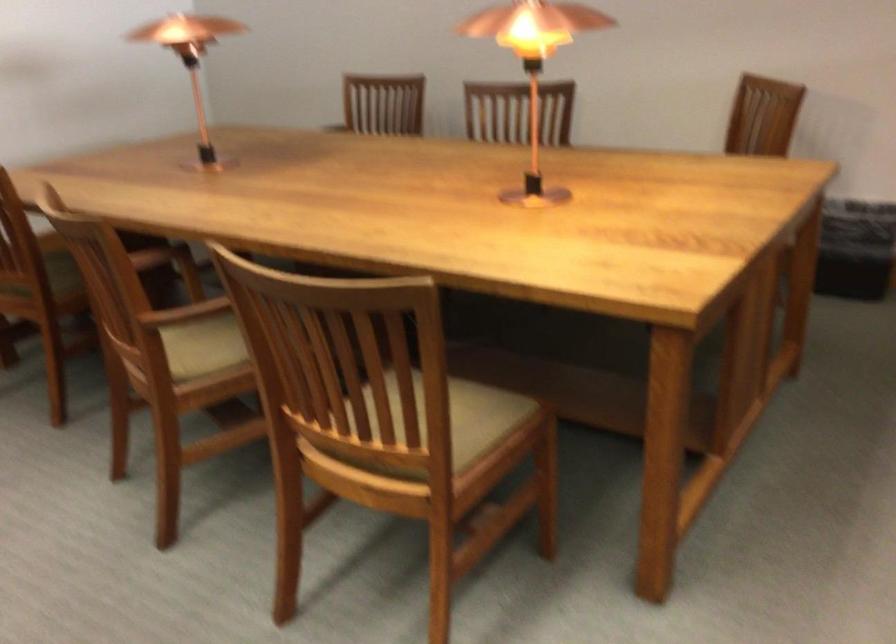
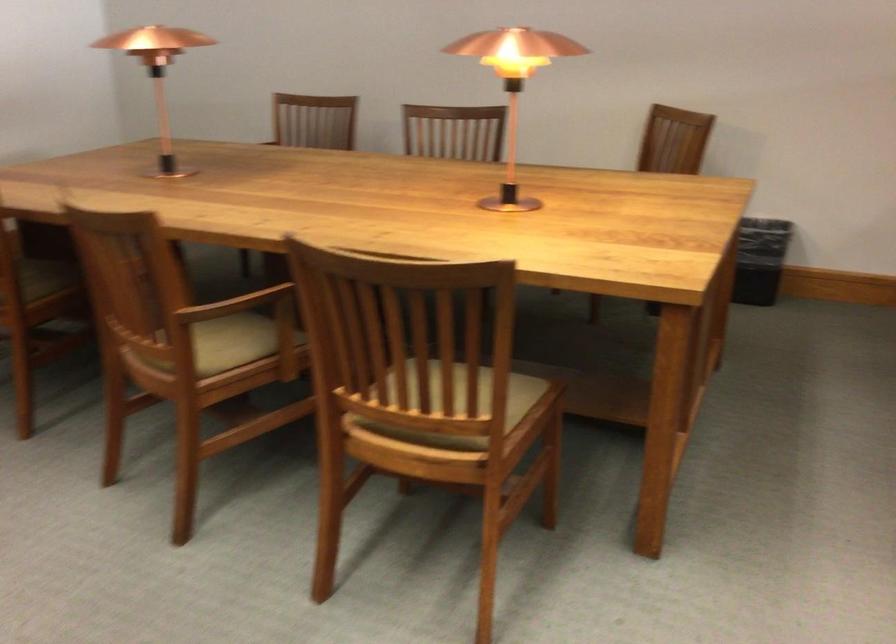
In the second image, find the point that corresponds to [354,178] in the first image.

(332, 189)